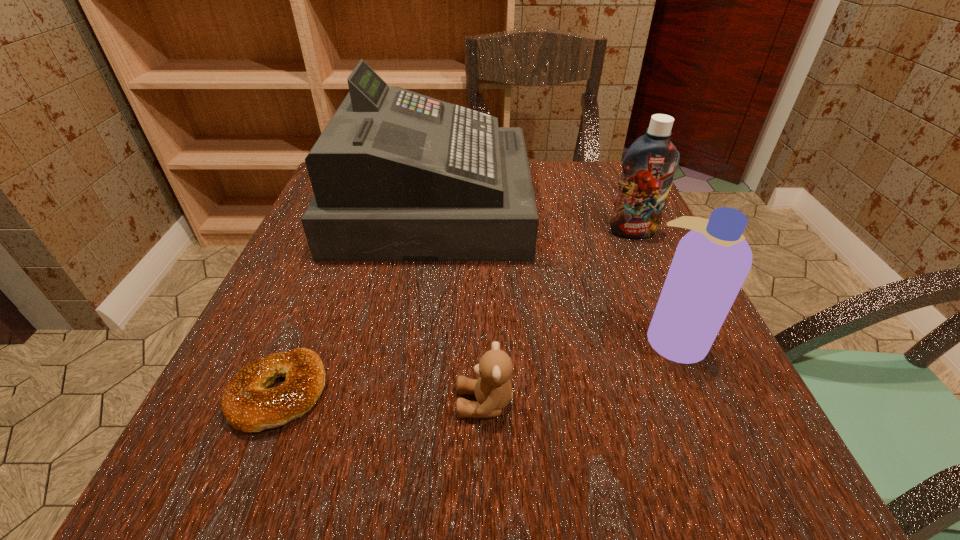
Locate an element on the screen. cash register is located at coordinates (397, 176).

Locate an element on the screen. the farther shampoo is located at coordinates (649, 165).

Find the location of a particular element. the nearer shampoo is located at coordinates (711, 262).

Locate an element on the screen. The height and width of the screenshot is (540, 960). the second shortest object is located at coordinates (493, 391).

At what (x,y) coordinates should I click in order to perform the action: click on the shortest object. Please return your answer as a coordinate pair (x, y). Looking at the image, I should click on (247, 404).

Find the location of a particular element. vacant space located 0.170m on the front-facing side of the cash register is located at coordinates (601, 206).

Where is `free spot located on the front label of the farther shampoo`? The height and width of the screenshot is (540, 960). free spot located on the front label of the farther shampoo is located at coordinates (680, 336).

This screenshot has height=540, width=960. I want to click on vacant space located 0.170m on the left of the nearer shampoo, so click(536, 338).

Image resolution: width=960 pixels, height=540 pixels. Identify the location of vacant space located on the face of the teddy bear. (321, 403).

Identify the location of free space located on the face of the teddy bear. Image resolution: width=960 pixels, height=540 pixels. (321, 403).